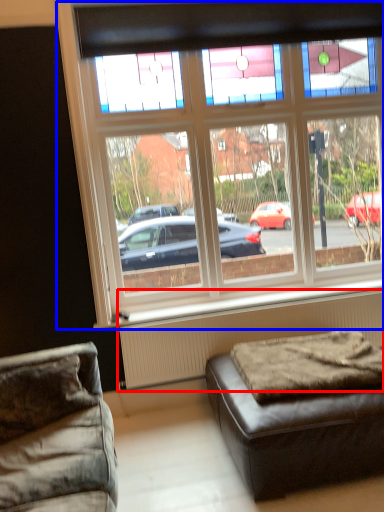
Question: Which point is closer to the camera, radiator (highlighted by a red box) or window (highlighted by a blue box)?

Choices:
 (A) radiator
 (B) window

Answer: (B)